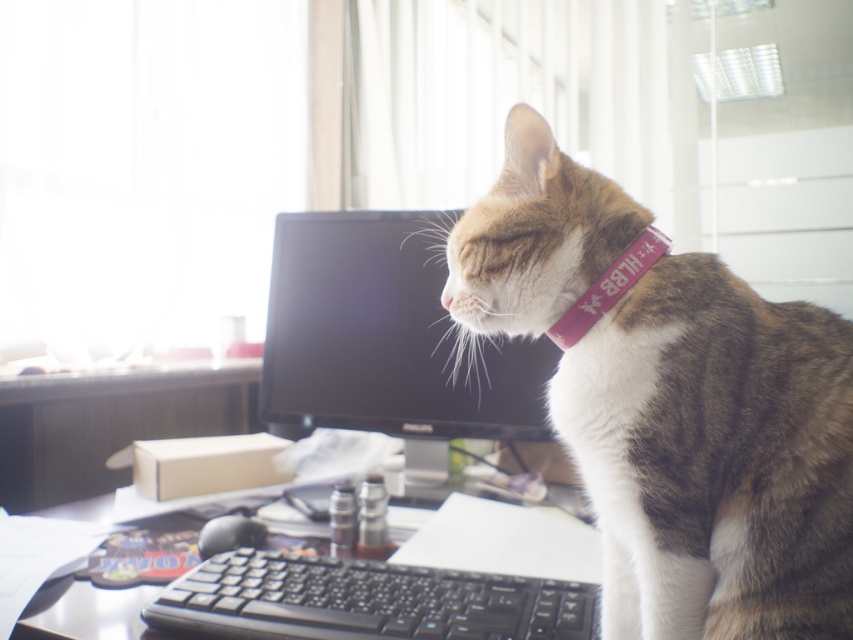
Does point (686, 484) lie behind point (405, 532)?

That is False.

Can you confirm if tabby fur cat at center is smaller than black plastic keyboard at center?

No.

Who is more distant from viewer, (734,492) or (55,627)?

The point (55,627) is more distant.

In order to click on tabby fur cat at center in this screenshot , I will do `click(672, 404)`.

Is black plastic keyboard at lower center positioned before black plastic keyboard at center?

Yes, black plastic keyboard at lower center is closer to the viewer.

At what (x,y) coordinates should I click in order to perform the action: click on black plastic keyboard at lower center. Please return your answer as a coordinate pair (x, y). The height and width of the screenshot is (640, 853). Looking at the image, I should click on tap(367, 600).

Is point (343, 621) more distant than point (99, 618)?

That is False.

Identify the location of black plastic keyboard at lower center. (367, 600).

Who is higher up, black glossy monitor at center or black plastic keyboard at lower center?

black glossy monitor at center is above.

Does point (480, 412) come farther from viewer compared to point (376, 620)?

Yes, it is.

The width and height of the screenshot is (853, 640). What are the coordinates of `black glossy monitor at center` in the screenshot? It's located at (387, 337).